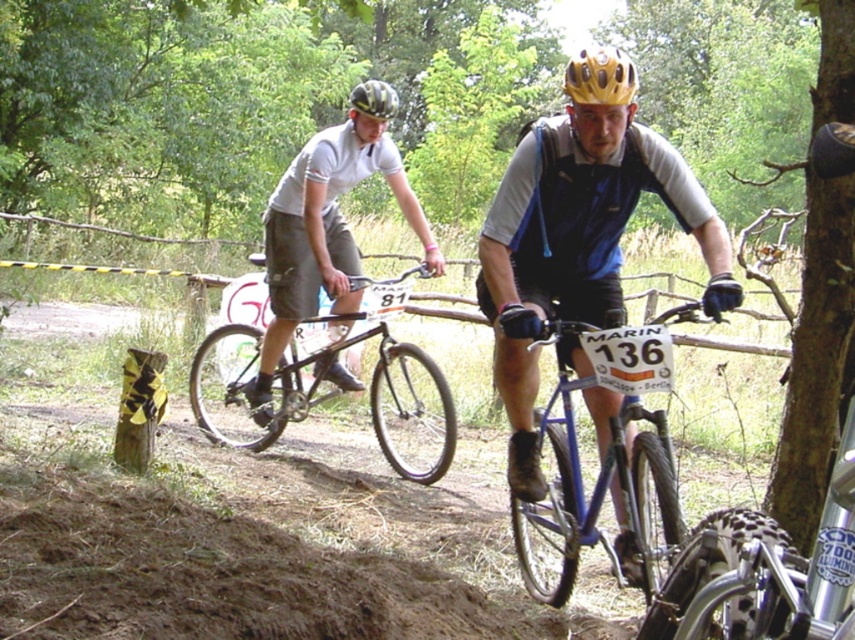
Is blue metallic bicycle at center wider than matte black helmet at upper center?

In fact, blue metallic bicycle at center might be narrower than matte black helmet at upper center.

Does point (572, 337) come in front of point (396, 106)?

Yes, point (572, 337) is in front of point (396, 106).

This screenshot has width=855, height=640. What do you see at coordinates (596, 481) in the screenshot? I see `blue metallic bicycle at center` at bounding box center [596, 481].

Where is `blue metallic bicycle at center`? Image resolution: width=855 pixels, height=640 pixels. blue metallic bicycle at center is located at coordinates (596, 481).

Is point (219, 332) farther from camera compared to point (579, 90)?

Yes, point (219, 332) is behind point (579, 90).

Does point (220, 406) lie in front of point (593, 92)?

No, (220, 406) is further to viewer.

Where is `black matte bicycle at center`? black matte bicycle at center is located at coordinates (243, 384).

Which is behind, point (618, 125) or point (647, 381)?

The point (618, 125) is behind.

Measure the distance between point (509, 346) and camera.

Point (509, 346) is 4.03 meters away from camera.

At what (x,y) coordinates should I click in order to perform the action: click on blue matte bicycle at center. Please return your answer as a coordinate pair (x, y). Image resolution: width=855 pixels, height=640 pixels. Looking at the image, I should click on (576, 246).